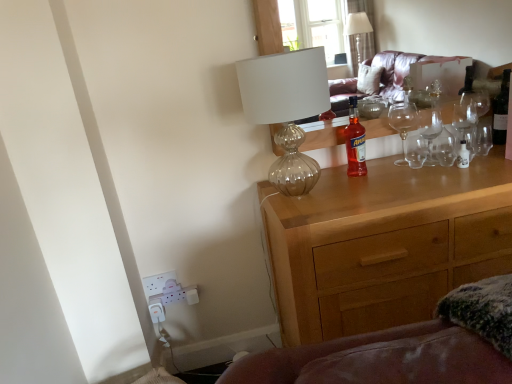
Locate an element on the screen. The width and height of the screenshot is (512, 384). free space above wooden chest of drawers at center (from a real-world perspective) is located at coordinates (369, 181).